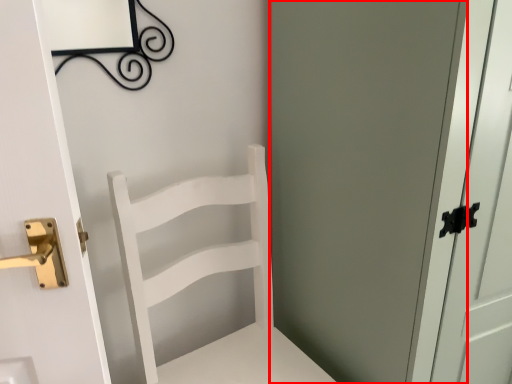
Question: From the image, what is the correct spatial relationship of screen door (annotated by the red box) in relation to furniture?

Choices:
 (A) right
 (B) left

Answer: (A)